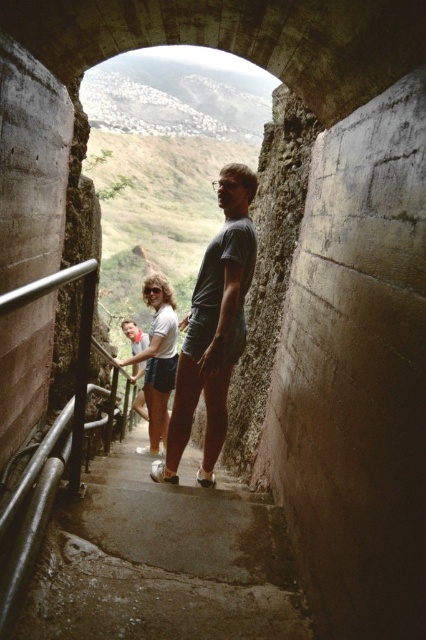
In the scene shown: Is gray cotton t-shirt at center shorter than white cotton shirt at center?

In fact, gray cotton t-shirt at center may be taller than white cotton shirt at center.

Between point (175, 392) and point (169, 326), which one is positioned behind?

The point (169, 326) is more distant.

Identify the location of gray cotton t-shirt at center. (213, 328).